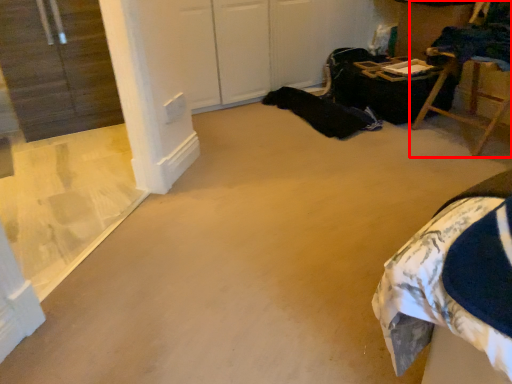
Question: From the image's perspective, where is furniture (annotated by the red box) located relative to window?

Choices:
 (A) above
 (B) below

Answer: (A)